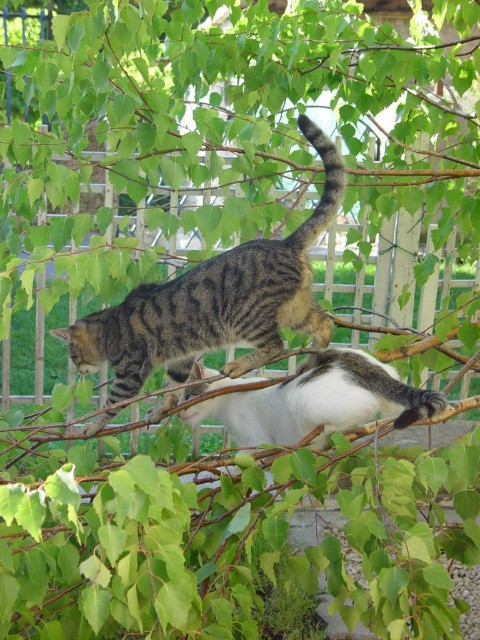
Question: Among these objects, which one is nearest to the camera?

Choices:
 (A) tabby fur cat at center
 (B) white-gray fur cat at center

Answer: (B)

Question: Does tabby fur cat at center appear over white-gray fur cat at center?

Choices:
 (A) yes
 (B) no

Answer: (A)

Question: In this image, where is tabby fur cat at center located relative to white-gray fur cat at center?

Choices:
 (A) left
 (B) right

Answer: (A)

Question: Is tabby fur cat at center to the right of white-gray fur cat at center from the viewer's perspective?

Choices:
 (A) yes
 (B) no

Answer: (B)

Question: Which of the following is the closest to the observer?

Choices:
 (A) (90, 332)
 (B) (336, 353)

Answer: (B)